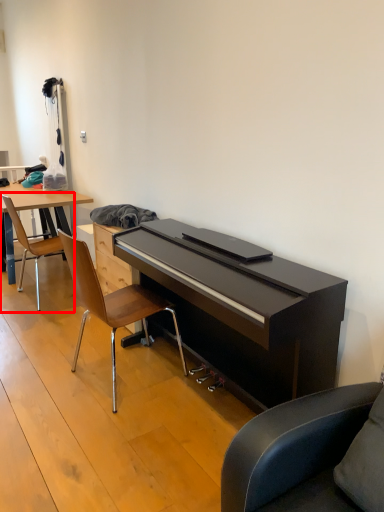
Question: Considering the relative positions of chair (annotated by the red box) and chair in the image provided, where is chair (annotated by the red box) located with respect to the staircase?

Choices:
 (A) right
 (B) left

Answer: (B)